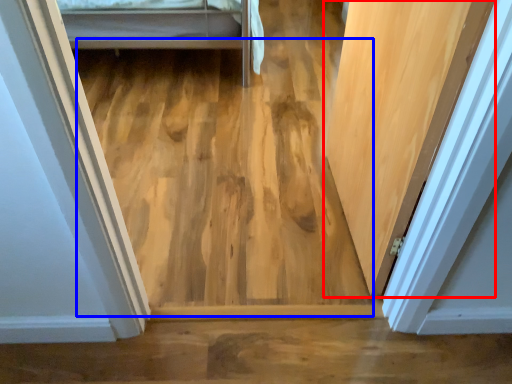
Question: Which object is closer to the camera taking this photo, door (highlighted by a red box) or plywood (highlighted by a blue box)?

Choices:
 (A) door
 (B) plywood

Answer: (A)